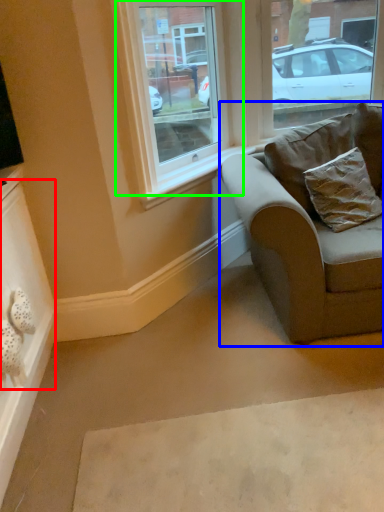
Question: Considering the real-world distances, which object is closest to drawer (highlighted by a red box)? studio couch (highlighted by a blue box) or window (highlighted by a green box).

Choices:
 (A) studio couch
 (B) window

Answer: (A)